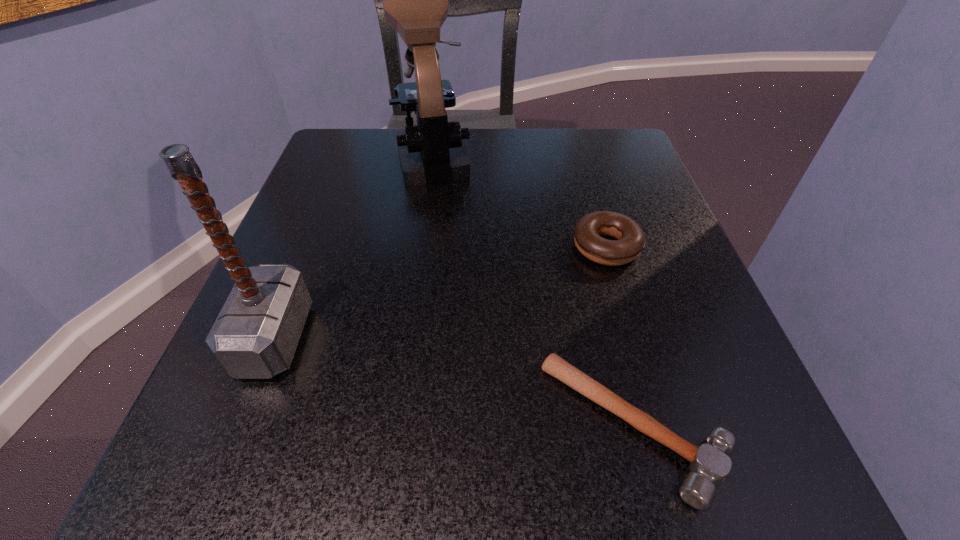
Find the location of a particular element. This screenshot has height=540, width=960. vacant region that satisfies the following two spatial constraints: 1. on the striking surface of the leftmost object; 2. on the left side of the shorter hammer is located at coordinates (240, 427).

Identify the location of free space that satisfies the following two spatial constraints: 1. on the striking surface of the left hammer; 2. on the back side of the right hammer. The width and height of the screenshot is (960, 540). (240, 427).

Locate an element on the screen. The image size is (960, 540). vacant space that satisfies the following two spatial constraints: 1. on the back side of the shorter hammer; 2. on the left side of the doughnut is located at coordinates (588, 247).

Locate an element on the screen. This screenshot has height=540, width=960. vacant position in the image that satisfies the following two spatial constraints: 1. on the striking surface of the left hammer; 2. on the back side of the shortest object is located at coordinates (240, 427).

Locate an element on the screen. The image size is (960, 540). free spot that satisfies the following two spatial constraints: 1. on the front side of the microscope; 2. on the striking surface of the leftmost object is located at coordinates (408, 338).